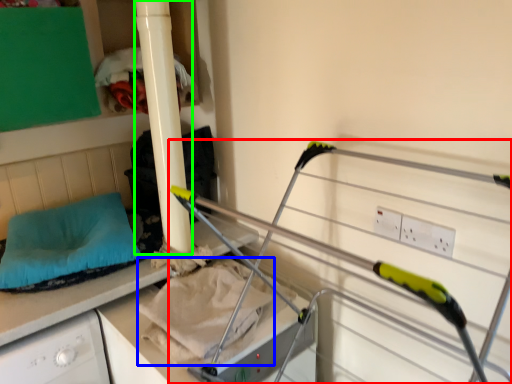
Question: Considering the real-world distances, which object is farthest from bunk bed (highlighted by a red box)? sheet (highlighted by a blue box) or pillar (highlighted by a green box)?

Choices:
 (A) sheet
 (B) pillar

Answer: (B)